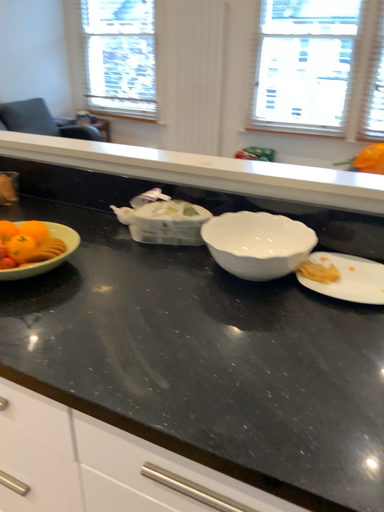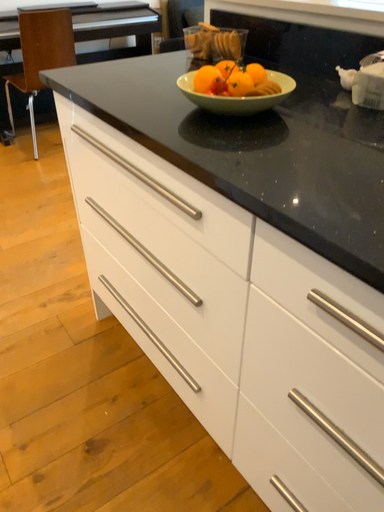
Question: How did the camera likely rotate when shooting the video?

Choices:
 (A) rotated downward
 (B) rotated upward

Answer: (A)